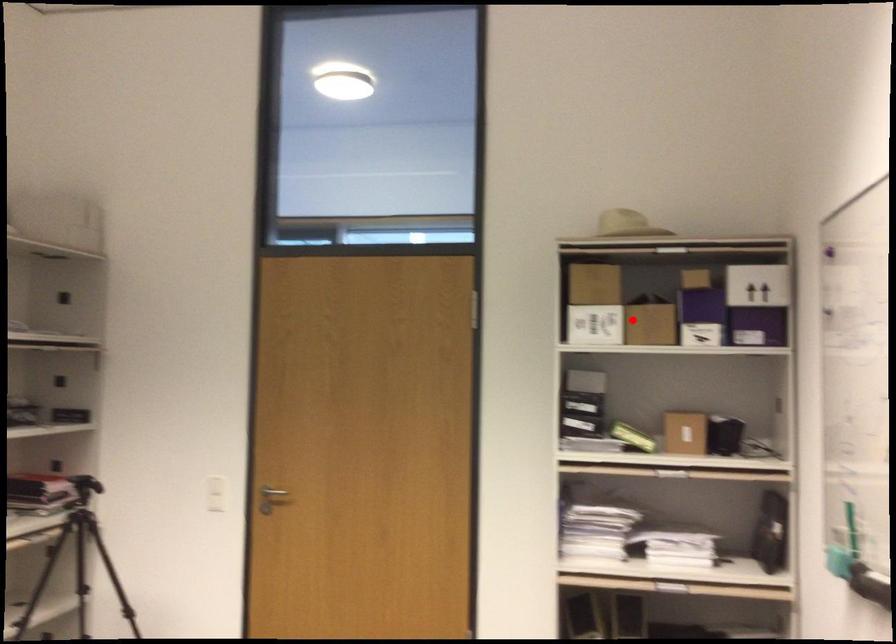
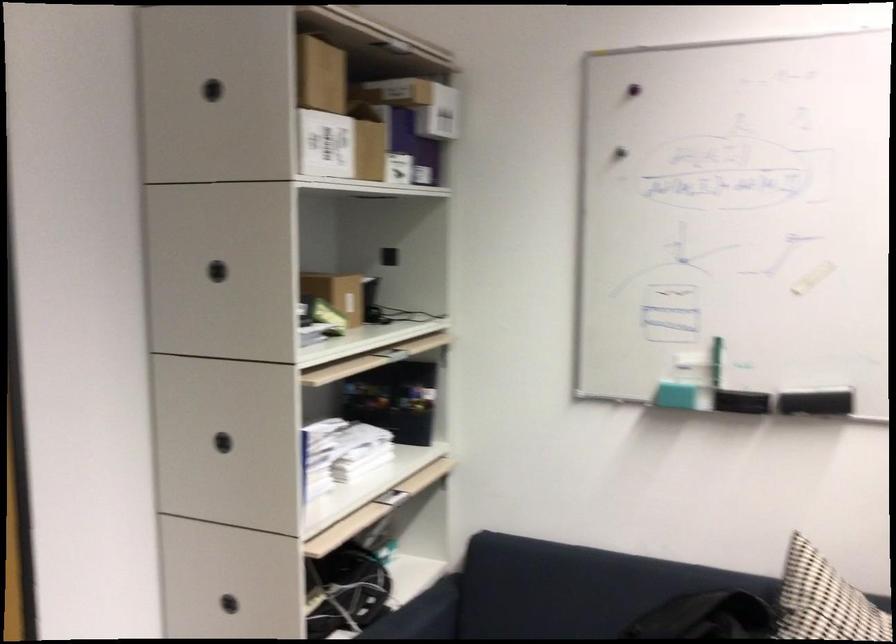
Question: I am providing you with two images of the same scene from different viewpoints. Given a red point in image1, look at the same physical point in image2. Is it:

Choices:
 (A) Closer to the viewpoint
 (B) Farther from the viewpoint

Answer: (A)